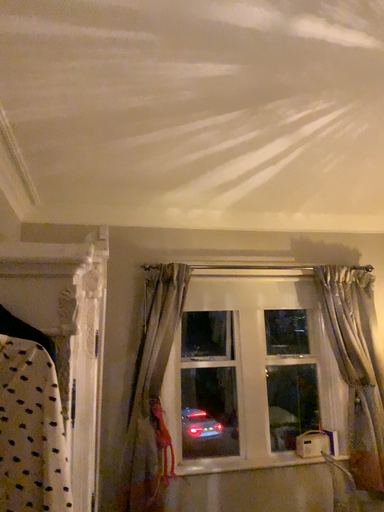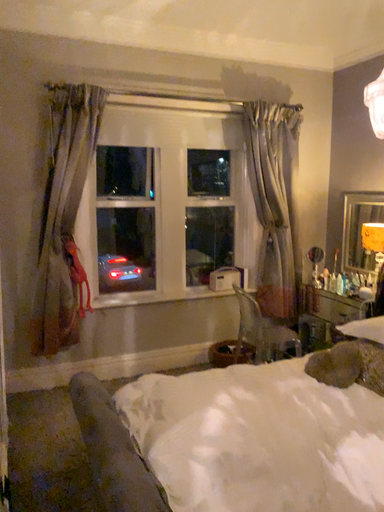
Question: Which way did the camera rotate in the video?

Choices:
 (A) rotated left
 (B) rotated right

Answer: (B)